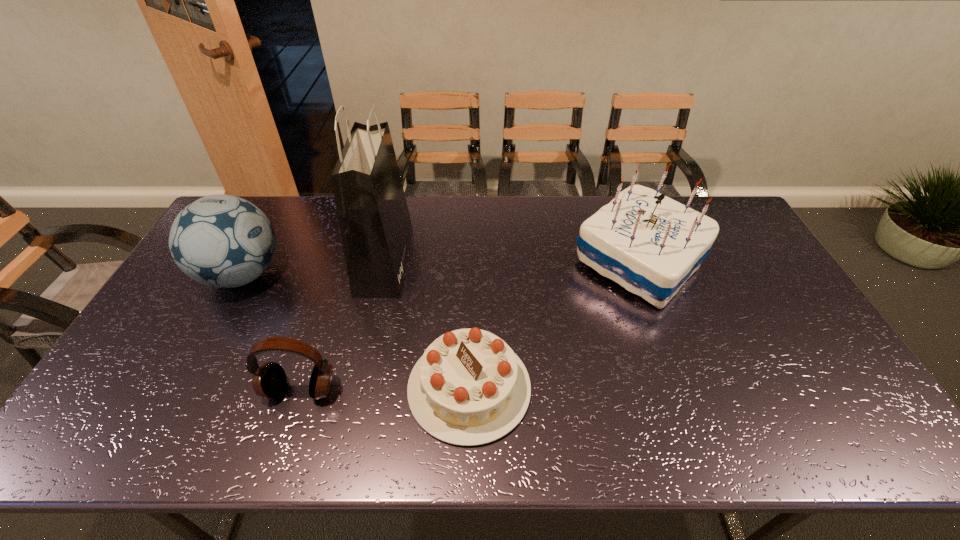
Locate an element on the screen. Image resolution: width=960 pixels, height=540 pixels. vacant space at the far right corner of the desktop is located at coordinates (711, 211).

Where is `vacant space at the near right corner`? The image size is (960, 540). vacant space at the near right corner is located at coordinates (875, 438).

The width and height of the screenshot is (960, 540). What are the coordinates of `empty space that is in between the right birthday cake and the soccer ball` in the screenshot? It's located at (441, 268).

The height and width of the screenshot is (540, 960). Identify the location of blank region between the second shortest object and the nearer birthday cake. (385, 389).

Find the location of `empty space between the taller birthday cake and the fourth tallest object`. empty space between the taller birthday cake and the fourth tallest object is located at coordinates (469, 326).

Where is `vacant area that lies between the second shortest object and the nearer birthday cake`? This screenshot has width=960, height=540. vacant area that lies between the second shortest object and the nearer birthday cake is located at coordinates (385, 389).

This screenshot has height=540, width=960. Find the location of `unoccupied position between the tallest object and the headset`. unoccupied position between the tallest object and the headset is located at coordinates (343, 325).

Find the location of a particular element. Image resolution: width=960 pixels, height=540 pixels. vacant space in between the second shortest object and the farther birthday cake is located at coordinates (469, 326).

Where is `empty location between the right birthday cake and the soccer ball`? The height and width of the screenshot is (540, 960). empty location between the right birthday cake and the soccer ball is located at coordinates (441, 268).

Locate an element on the screen. Image resolution: width=960 pixels, height=540 pixels. free space between the leftmost object and the shopping bag is located at coordinates (314, 268).